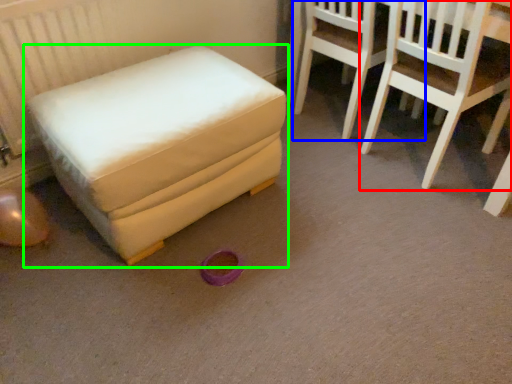
Question: Which object is positioned closest to chair (highlighted by a red box)? Select from chair (highlighted by a blue box) and furniture (highlighted by a green box).

Choices:
 (A) chair
 (B) furniture

Answer: (A)